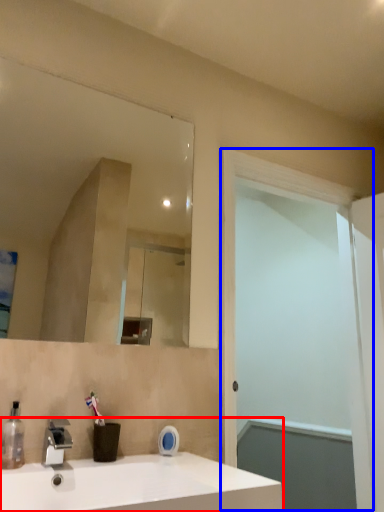
Question: Which of the following is the farthest to the observer, sink (highlighted by a red box) or screen door (highlighted by a blue box)?

Choices:
 (A) sink
 (B) screen door

Answer: (B)